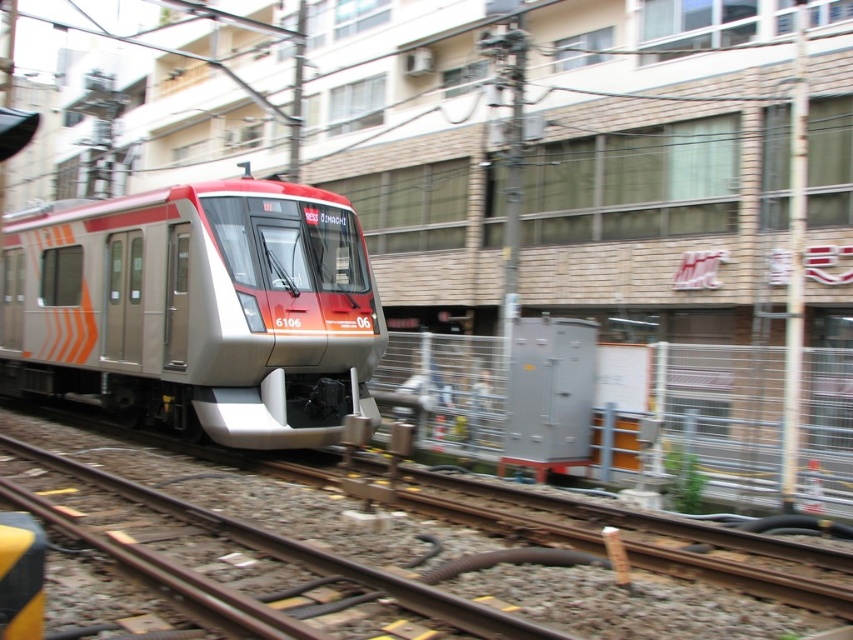
Question: Is metallic silver train at center to the right of metallic gray transformer at center-right from the viewer's perspective?

Choices:
 (A) no
 (B) yes

Answer: (A)

Question: Which point is closer to the camera taking this photo?

Choices:
 (A) (579, 342)
 (B) (173, 289)

Answer: (A)

Question: Among these points, which one is farthest from the camera?

Choices:
 (A) [9, 348]
 (B) [579, 419]

Answer: (A)

Question: Is metallic silver train at center wider than metallic gray transformer at center-right?

Choices:
 (A) no
 (B) yes

Answer: (A)

Question: Does metallic silver train at center appear under metallic gray transformer at center-right?

Choices:
 (A) no
 (B) yes

Answer: (B)